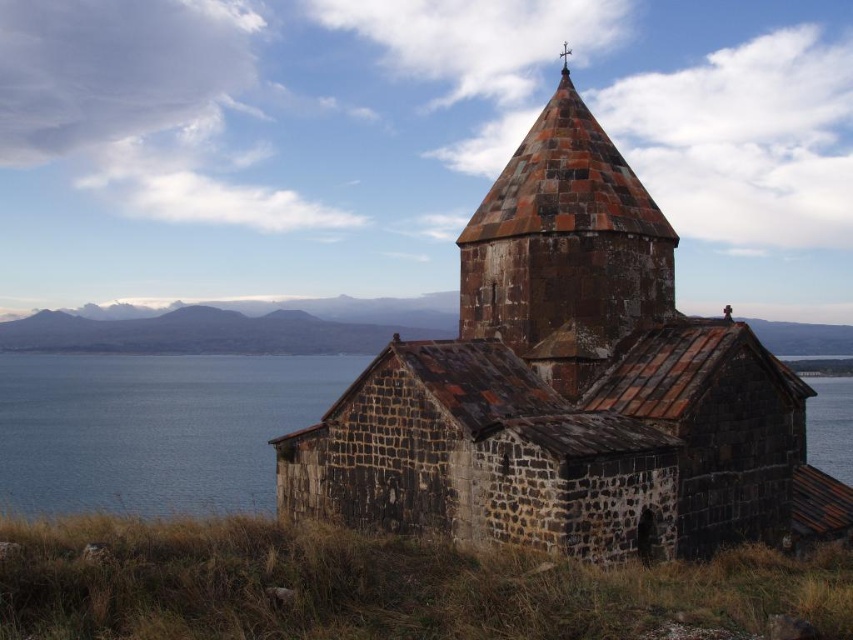
You are a photographer planning to capture the rustic stone tower at center and the blue water at left in a single shot. Based on their positions, which object should you focus on first to ensure both are in frame?

The rustic stone tower at center is behind the blue water at left, so you should focus on the blue water at left first to ensure both are in frame.

You are standing on the grassy hillside near the church and want to walk to the blue water at left. Which direction should you head relative to the rustic stone tower at center?

The blue water at left is located below the rustic stone tower at center, so you should head downward towards the blue water at left to reach it.